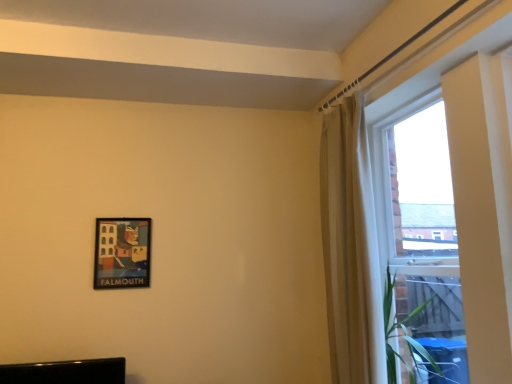
Question: From the image's perspective, would you say beige fabric curtain at upper right is positioned over transparent glass window at right?

Choices:
 (A) no
 (B) yes

Answer: (A)

Question: Could you tell me if beige fabric curtain at upper right is facing transparent glass window at right?

Choices:
 (A) yes
 (B) no

Answer: (B)

Question: Is beige fabric curtain at upper right outside transparent glass window at right?

Choices:
 (A) no
 (B) yes

Answer: (B)

Question: From a real-world perspective, is beige fabric curtain at upper right below transparent glass window at right?

Choices:
 (A) no
 (B) yes

Answer: (A)

Question: Is beige fabric curtain at upper right wider than transparent glass window at right?

Choices:
 (A) yes
 (B) no

Answer: (B)

Question: Considering the positions of transparent glass window at right and beige fabric curtain at upper right in the image, is transparent glass window at right wider or thinner than beige fabric curtain at upper right?

Choices:
 (A) thin
 (B) wide

Answer: (B)

Question: Is point (326, 208) positioned closer to the camera than point (351, 115)?

Choices:
 (A) farther
 (B) closer

Answer: (A)

Question: From a real-world perspective, relative to beige fabric curtain at upper right, is transparent glass window at right vertically above or below?

Choices:
 (A) below
 (B) above

Answer: (A)

Question: Is transparent glass window at right bigger or smaller than beige fabric curtain at upper right?

Choices:
 (A) big
 (B) small

Answer: (A)

Question: Would you say beige fabric curtain at upper right is to the left or to the right of transparent glass window at right in the picture?

Choices:
 (A) right
 (B) left

Answer: (B)

Question: Looking at their shapes, would you say beige fabric curtain at upper right is wider or thinner than transparent glass window at right?

Choices:
 (A) thin
 (B) wide

Answer: (A)

Question: In terms of height, does beige fabric curtain at upper right look taller or shorter compared to transparent glass window at right?

Choices:
 (A) short
 (B) tall

Answer: (B)

Question: From the image's perspective, is beige fabric curtain at upper right located above or below transparent glass window at right?

Choices:
 (A) below
 (B) above

Answer: (A)

Question: Do you think matte black picture frame at lower left is within transparent glass window at right, or outside of it?

Choices:
 (A) outside
 (B) inside

Answer: (A)

Question: From a real-world perspective, relative to transparent glass window at right, is matte black picture frame at lower left vertically above or below?

Choices:
 (A) above
 (B) below

Answer: (B)